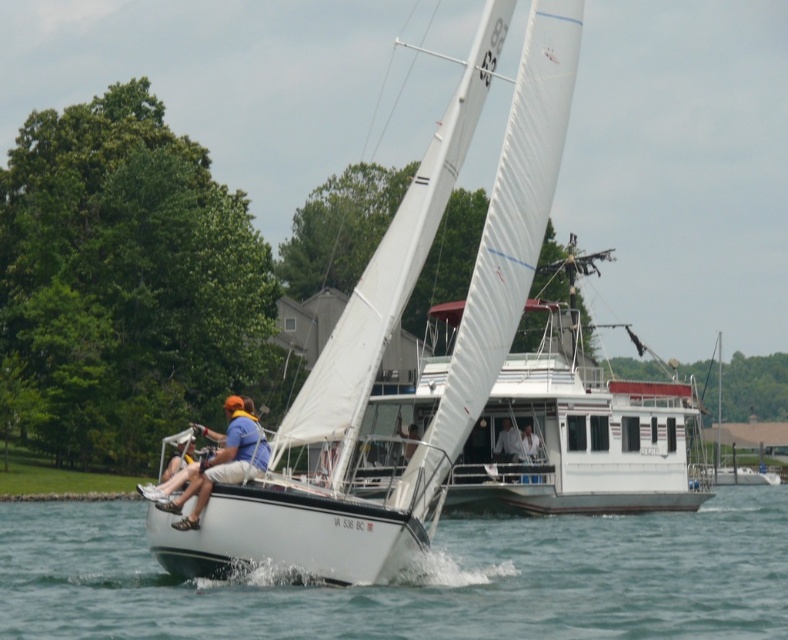
Question: Is white glossy sailboat at center above white fabric shirt at center?

Choices:
 (A) yes
 (B) no

Answer: (A)

Question: Is white fabric sailboat at center bigger than white fabric shirt at center?

Choices:
 (A) no
 (B) yes

Answer: (B)

Question: Which point is closer to the camera taking this photo?

Choices:
 (A) (281, 554)
 (B) (630, 598)
 (C) (519, 445)

Answer: (A)

Question: Is white matte sailboat at center closer to the viewer compared to white glossy sailboat at center?

Choices:
 (A) no
 (B) yes

Answer: (B)

Question: Which object is the farthest from the white smooth water at center?

Choices:
 (A) orange life vest at center
 (B) white fabric sailboat at center
 (C) white fabric shirt at center

Answer: (A)

Question: Among these points, which one is nearest to the camera?

Choices:
 (A) (376, 323)
 (B) (597, 371)
 (C) (169, 524)

Answer: (C)